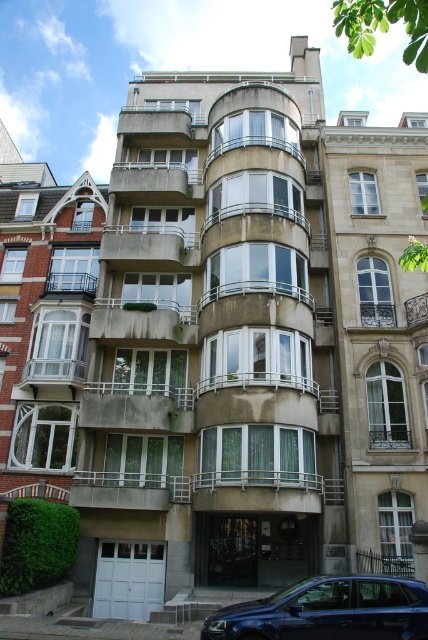
You are a delivery person trying to park your 1.2 meter wide delivery cart between the concrete balcony at center and the concrete at center. Based on the scene, can you fit your cart in that space?

The concrete balcony at center might be wider than concrete at center, so the space between them may be sufficient to accommodate the 1.2 meter wide delivery cart. However, since the exact width isn not specified, there is uncertainty in determining if it will fit perfectly.